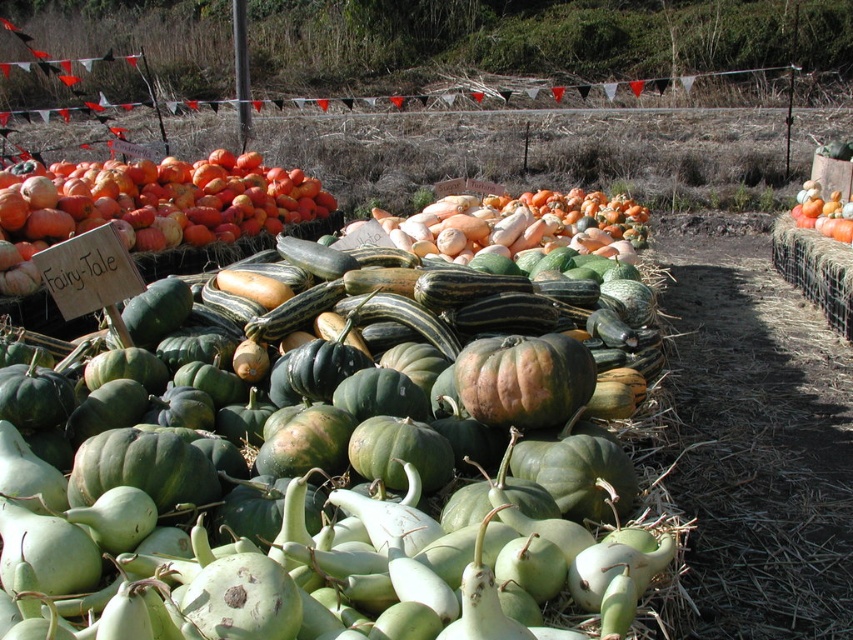
Question: Is matte orange pumpkin at upper left positioned in front of rough textured pumpkin at center?

Choices:
 (A) no
 (B) yes

Answer: (A)

Question: Which of the following is the closest to the observer?

Choices:
 (A) smooth orange squash at center
 (B) rough textured pumpkin at center
 (C) orange matte pumpkin at center
 (D) matte orange pumpkin at upper left

Answer: (B)

Question: Can you confirm if matte orange pumpkin at upper left is positioned to the right of orange matte pumpkin at center?

Choices:
 (A) yes
 (B) no

Answer: (B)

Question: Can you confirm if green matte gourd at center is smaller than matte orange pumpkin at upper left?

Choices:
 (A) no
 (B) yes

Answer: (B)

Question: Which of the following is the farthest from the observer?

Choices:
 (A) (815, 202)
 (B) (19, 598)

Answer: (A)

Question: Which object is closer to the camera taking this photo?

Choices:
 (A) smooth orange squash at center
 (B) matte orange pumpkin at upper left
 (C) orange matte pumpkin at center
 (D) rough textured pumpkin at center

Answer: (D)